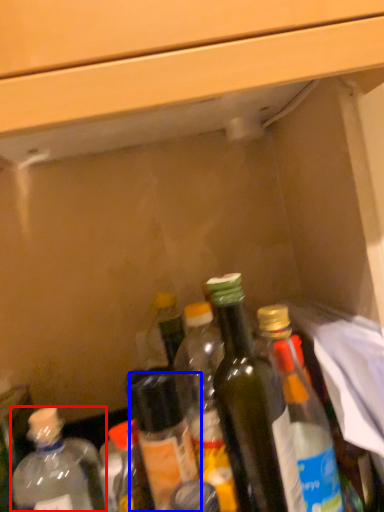
Question: Which of the following is the farthest to the observer, bottle (highlighted by a red box) or bottle (highlighted by a blue box)?

Choices:
 (A) bottle
 (B) bottle

Answer: (B)